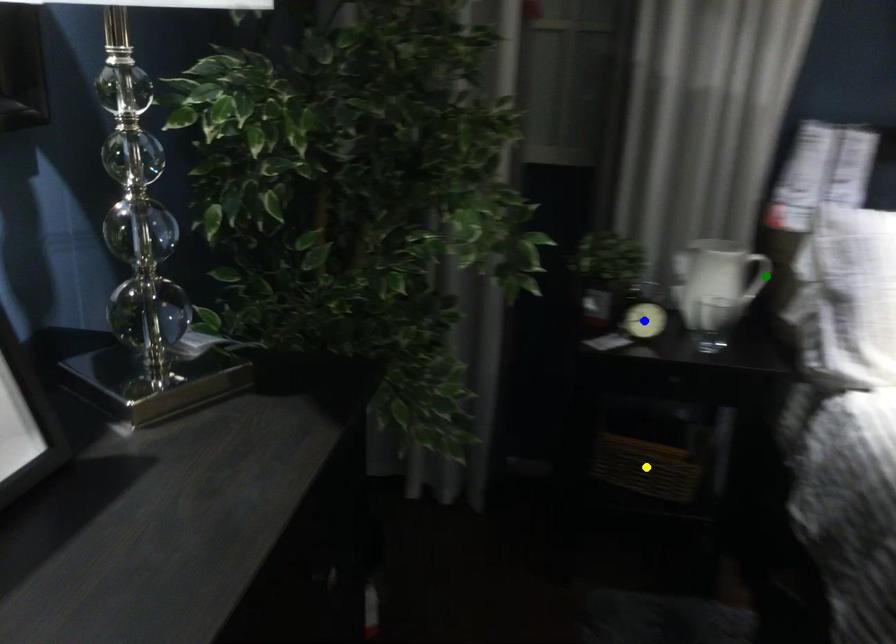
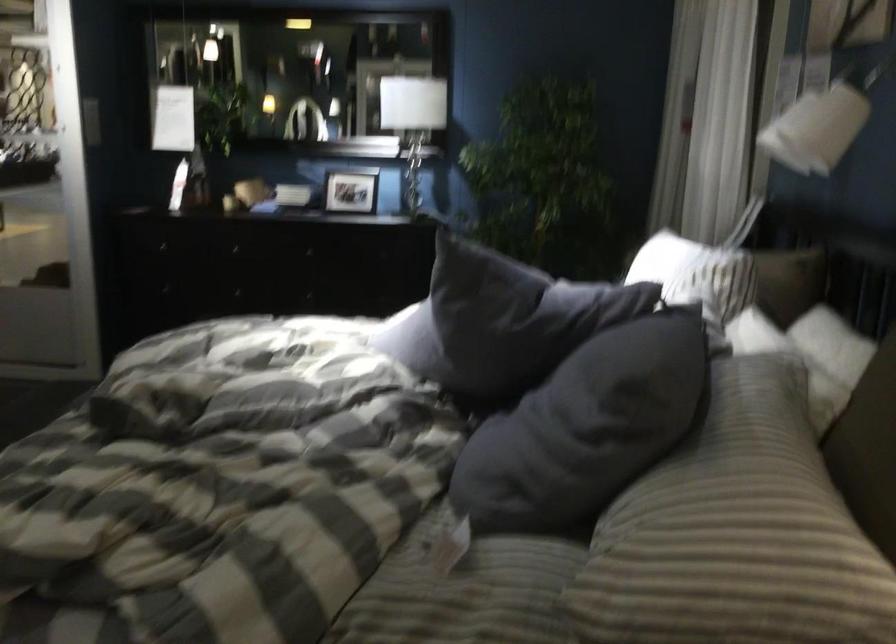
I am providing you with two images of the same scene from different viewpoints. Three points are marked in image1. Which point corresponds to a part or object that is occluded in image2?In image1, three points are marked. Which of them correspond to a part or object that is occluded in image2?Among the three points shown in image1, which one corresponds to a part or object that is no longer visible due to occlusion in image2?

Invisible in image2: green point, blue point, yellow point.